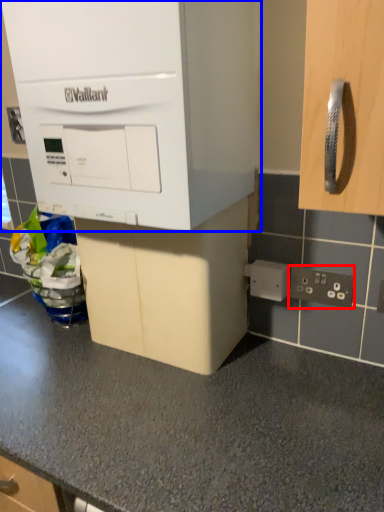
Question: Which point is closer to the camera, electric outlet (highlighted by a red box) or cabinetry (highlighted by a blue box)?

Choices:
 (A) electric outlet
 (B) cabinetry

Answer: (B)